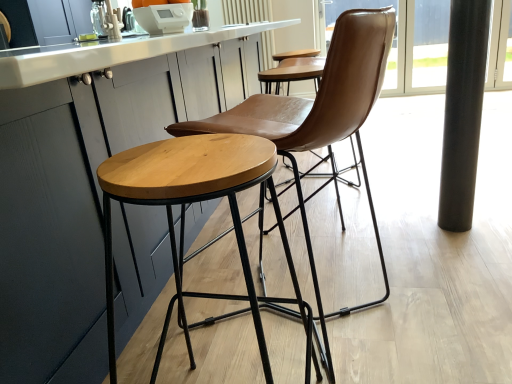
Locate an element on the screen. vacant area located to the right-hand side of black polished pole at right is located at coordinates (489, 214).